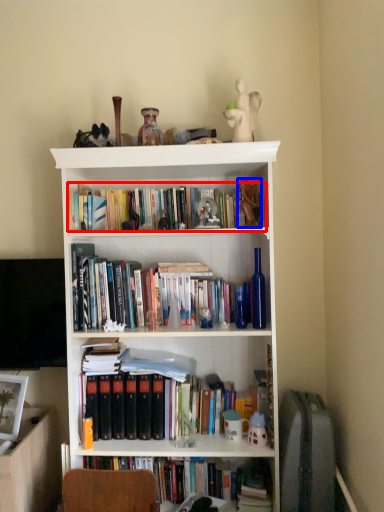
Question: Among these objects, which one is nearest to the camera, book (highlighted by a red box) or toy (highlighted by a blue box)?

Choices:
 (A) book
 (B) toy

Answer: (B)